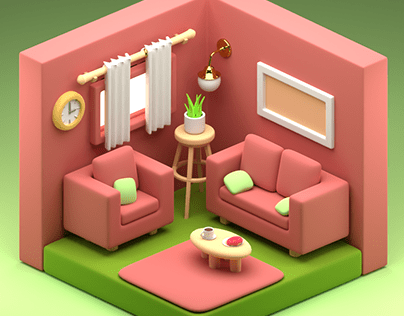
The height and width of the screenshot is (316, 404). In order to click on window in this screenshot , I will do `click(135, 100)`.